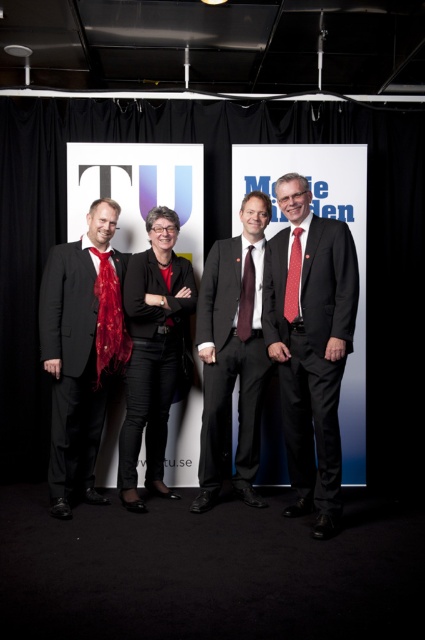
Question: Can you confirm if white paperboard at center is smaller than matte black suit at center?

Choices:
 (A) no
 (B) yes

Answer: (A)

Question: Which is farther from the shiny red scarf at left?

Choices:
 (A) matte black suit at center
 (B) dark gray suit at center

Answer: (A)

Question: Among these points, which one is nearest to the camera?

Choices:
 (A) (23, 316)
 (B) (257, 384)
 (C) (102, 312)
 (D) (169, 230)

Answer: (C)

Question: Does shiny red scarf at left appear under red satin tie at center?

Choices:
 (A) no
 (B) yes

Answer: (B)

Question: Which of the following is the closest to the observer?

Choices:
 (A) maroon satin tie at center
 (B) matte black suit at left

Answer: (B)

Question: Does shiny red scarf at left have a greater width compared to maroon satin tie at center?

Choices:
 (A) no
 (B) yes

Answer: (B)